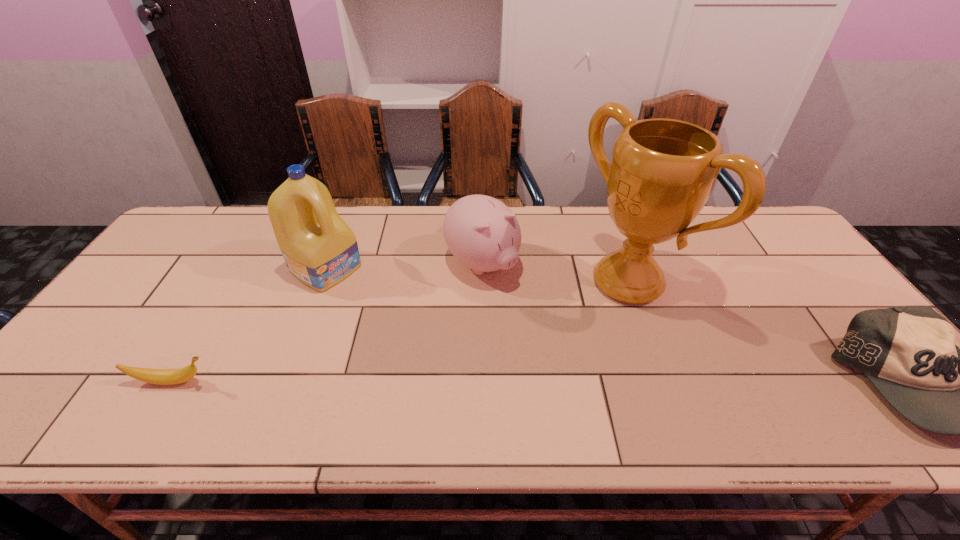
You are a GUI agent. You are given a task and a screenshot of the screen. Output one action in this format:
    pyautogui.click(x=<x>, y=<y>)
    Task: Click on the leftmost object
    
    Given the screenshot: What is the action you would take?
    pyautogui.click(x=154, y=376)

Where is `the shortest object`? The width and height of the screenshot is (960, 540). the shortest object is located at coordinates (154, 376).

Identify the location of the fourth object from right to left. (320, 250).

The width and height of the screenshot is (960, 540). Find the location of `the fourth shortest object`. the fourth shortest object is located at coordinates (320, 250).

Locate an element on the screen. This screenshot has width=960, height=540. the third object from left to right is located at coordinates (482, 233).

At what (x,y) coordinates should I click in order to perform the action: click on piggy bank. Please return your answer as a coordinate pair (x, y). Looking at the image, I should click on coord(482,233).

The image size is (960, 540). In order to click on award in this screenshot , I will do `click(662, 173)`.

You are a GUI agent. You are given a task and a screenshot of the screen. Output one action in this format:
    pyautogui.click(x=<x>, y=<y>)
    Task: Click on the tallest object
    The width and height of the screenshot is (960, 540).
    Given the screenshot: What is the action you would take?
    (x=662, y=173)

Identify the location of vacant region located at the stem of the leftmost object. The height and width of the screenshot is (540, 960). (328, 381).

Locate an element on the screen. The height and width of the screenshot is (540, 960). free space located 0.340m on the label of the second object from left to right is located at coordinates (441, 339).